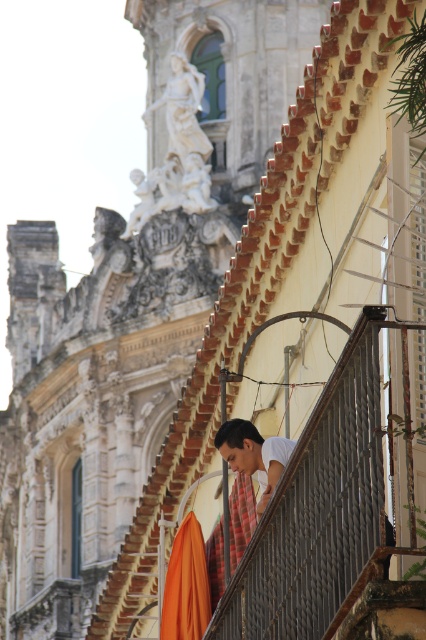
You are standing on the balcony and want to grab the orange fabric umbrella at lower center. You are currently holding the white matte shirt at center. Can you reach the umbrella without letting go of the shirt?

The orange fabric umbrella at lower center and white matte shirt at center are 8.10 feet apart. Since the distance is too large, you cannot reach the umbrella while holding the shirt.